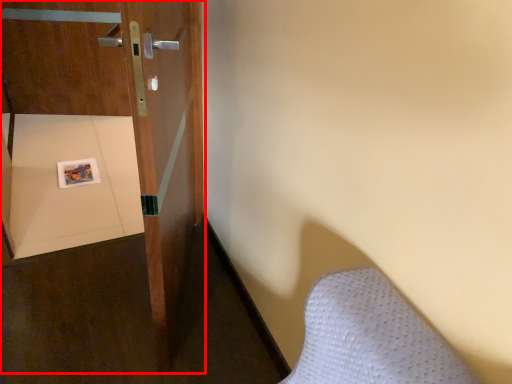
Question: In this image, where is door (annotated by the red box) located relative to copy?

Choices:
 (A) right
 (B) left

Answer: (A)